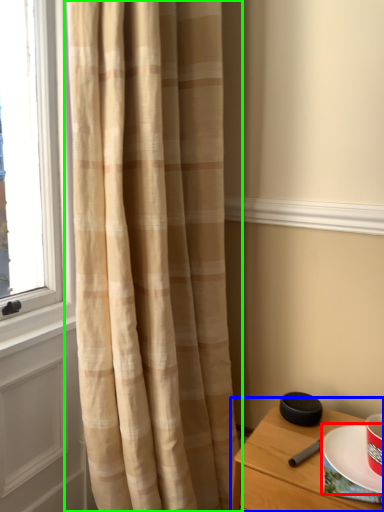
Question: Which object is the closest to the paper plate (highlighted by a red box)? Choose among these: nightstand (highlighted by a blue box) or curtain (highlighted by a green box).

Choices:
 (A) nightstand
 (B) curtain

Answer: (A)